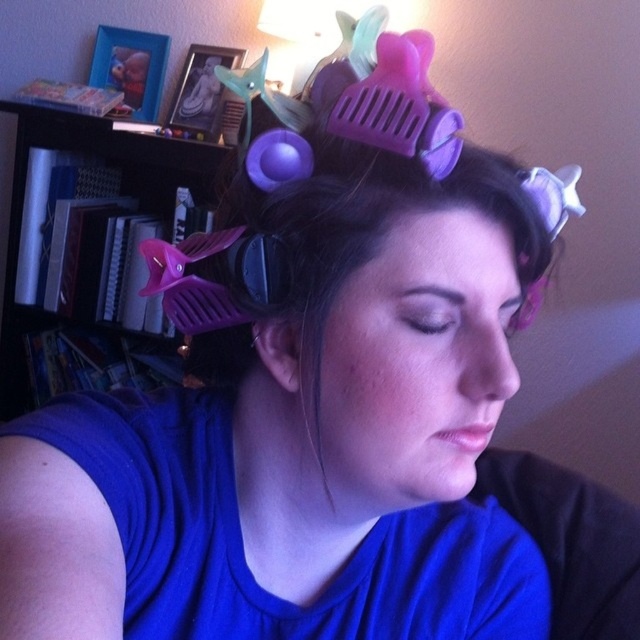
You are organizing a small party and need to place a decorative centerpiece on the nearest surface. You have a choice between placing it on the matte plastic bookshelf at left or another surface. Based on its position, which surface should you choose?

The matte plastic bookshelf at left is located at point [90,252], so it is the nearest surface to place the decorative centerpiece.

You are taking a photo of the scene and want to focus on both the point at location (304, 230) and the point at (214, 300). Which point should you adjust your focus to first to ensure both are in sharp view?

You should focus on point (304, 230) first because it is closer to the camera, allowing the second point to come into focus by adjusting the focus ring slightly backward.

You are a photographer setting up a shoot in this room. You need to place a small lamp exactly at point [90,252]. What object is located at that point?

The point [90,252] corresponds to the matte plastic bookshelf at left.